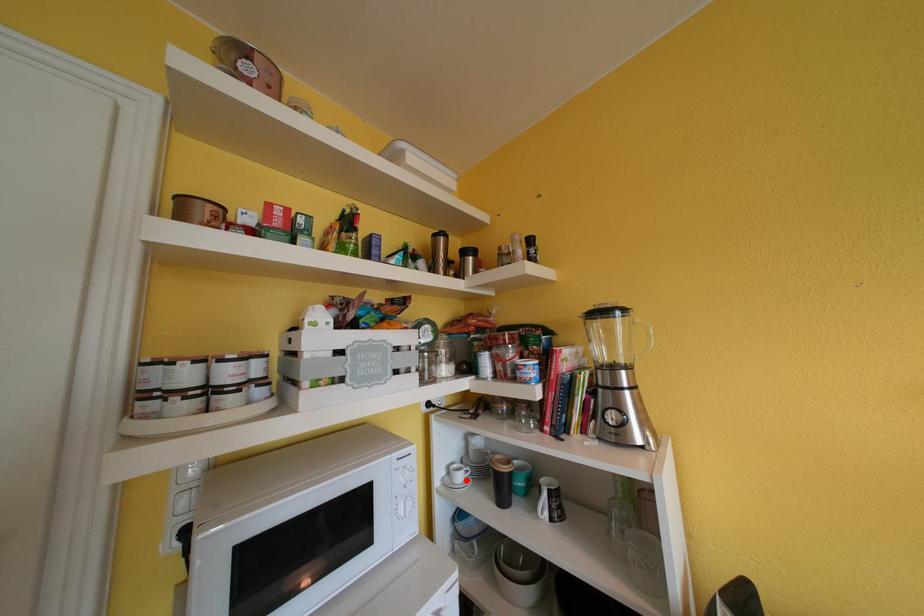
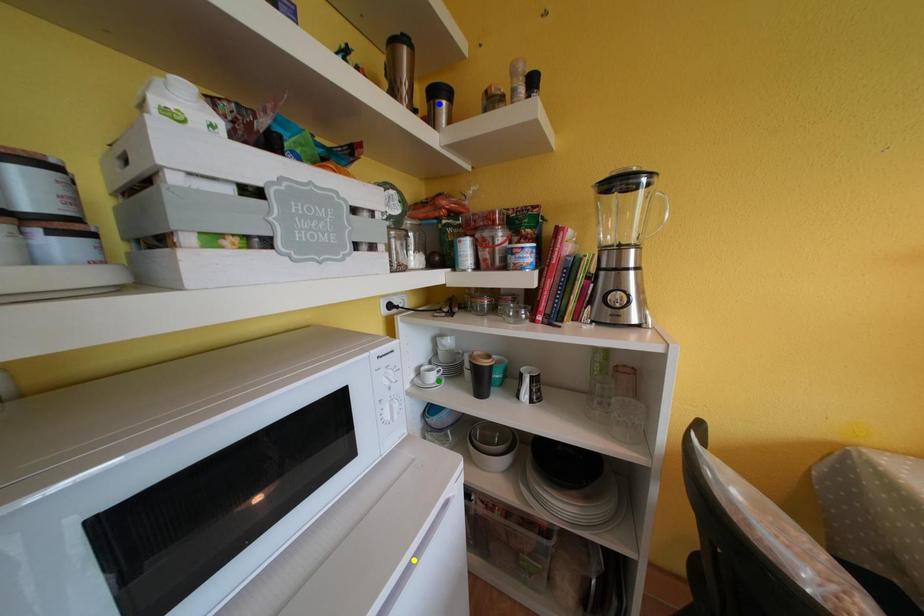
Question: I am providing you with two images of the same scene from different viewpoints. A red point is marked on the first image. You are given multiple points on the second image. In image 2, which mark is for the same physical point as the one in image 1?

Choices:
 (A) yellow point
 (B) green point
 (C) blue point

Answer: (B)